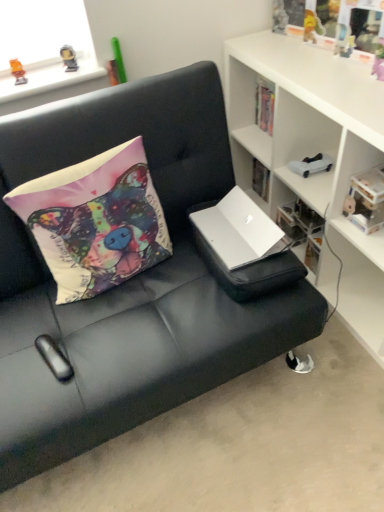
Question: Is white plastic book at upper right at the back of metallic gold figurine at upper left, which appears as the first toy when viewed from the top?

Choices:
 (A) yes
 (B) no

Answer: (B)

Question: Does metallic gold figurine at upper left, positioned as the 2th toy in front-to-back order, have a lesser height compared to white plastic book at upper right?

Choices:
 (A) no
 (B) yes

Answer: (B)

Question: From the image's perspective, is metallic gold figurine at upper left, marked as the 2th toy in a back-to-front arrangement, beneath white plastic book at upper right?

Choices:
 (A) no
 (B) yes

Answer: (A)

Question: From the image's perspective, would you say metallic gold figurine at upper left, which ranks as the second toy in right-to-left order, is positioned over white plastic book at upper right?

Choices:
 (A) yes
 (B) no

Answer: (A)

Question: Are metallic gold figurine at upper left, which ranks as the second toy in right-to-left order, and white plastic book at upper right beside each other?

Choices:
 (A) no
 (B) yes

Answer: (A)

Question: Is translucent plastic toy at upper left, which is counted as the 1th toy, starting from the front, bigger or smaller than white plastic toy car at upper right, the 1th toy in the right-to-left sequence?

Choices:
 (A) small
 (B) big

Answer: (A)

Question: From a real-world perspective, relative to white plastic toy car at upper right, the third toy when ordered from front to back, is translucent plastic toy at upper left, the 1th toy from the left, vertically above or below?

Choices:
 (A) above
 (B) below

Answer: (A)

Question: Looking at their shapes, would you say translucent plastic toy at upper left, the 1th toy from the left, is wider or thinner than white plastic toy car at upper right, the 1th toy in the right-to-left sequence?

Choices:
 (A) thin
 (B) wide

Answer: (A)

Question: Is translucent plastic toy at upper left, which is counted as the 1th toy, starting from the front, taller or shorter than white plastic toy car at upper right, which is the first toy in back-to-front order?

Choices:
 (A) tall
 (B) short

Answer: (A)

Question: Considering the positions of white matte cabinet at upper right and white plastic book at upper right in the image, is white matte cabinet at upper right taller or shorter than white plastic book at upper right?

Choices:
 (A) short
 (B) tall

Answer: (B)

Question: Is white matte cabinet at upper right inside or outside of white plastic book at upper right?

Choices:
 (A) inside
 (B) outside

Answer: (B)

Question: Considering the positions of white matte cabinet at upper right and white plastic book at upper right in the image, is white matte cabinet at upper right bigger or smaller than white plastic book at upper right?

Choices:
 (A) big
 (B) small

Answer: (A)

Question: Considering the positions of point (332, 181) and point (372, 208), is point (332, 181) closer or farther from the camera than point (372, 208)?

Choices:
 (A) closer
 (B) farther

Answer: (B)

Question: Is matte fabric pillow at upper left to the left or to the right of clear plastic storage at center in the image?

Choices:
 (A) left
 (B) right

Answer: (A)

Question: Which is correct: matte fabric pillow at upper left is inside clear plastic storage at center, or outside of it?

Choices:
 (A) inside
 (B) outside

Answer: (B)